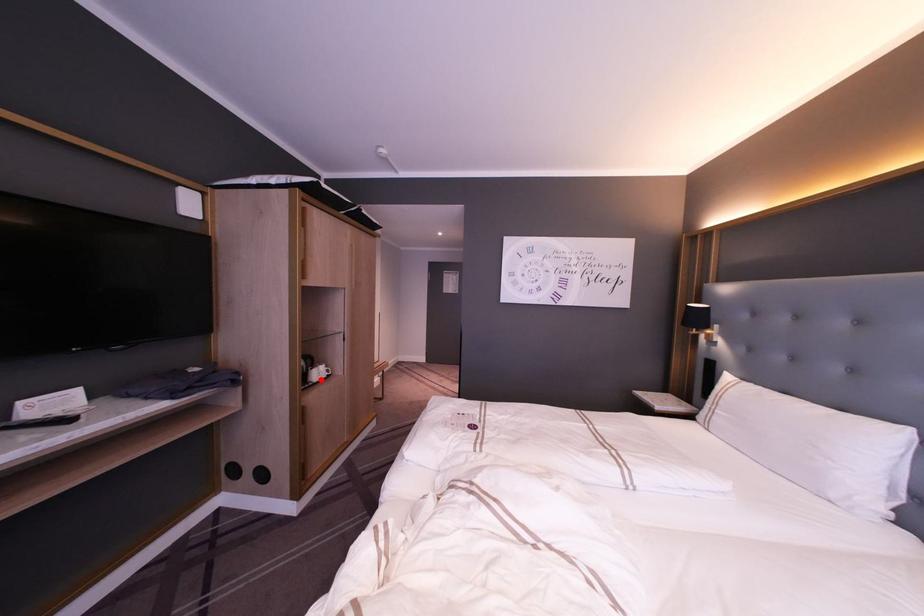
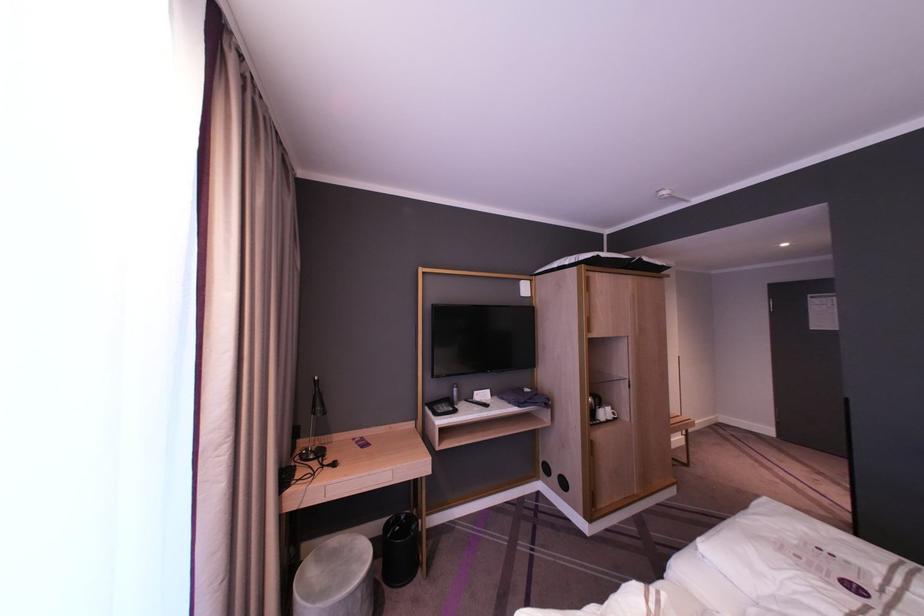
Where in the second image is the point corresponding to the highlighted location from the first image?

(606, 421)